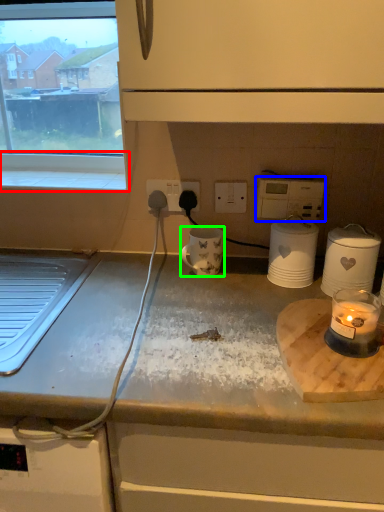
Question: Which object is positioned farthest from window sill (highlighted by a red box)? Select from appliance (highlighted by a blue box) and mug (highlighted by a green box).

Choices:
 (A) appliance
 (B) mug

Answer: (A)